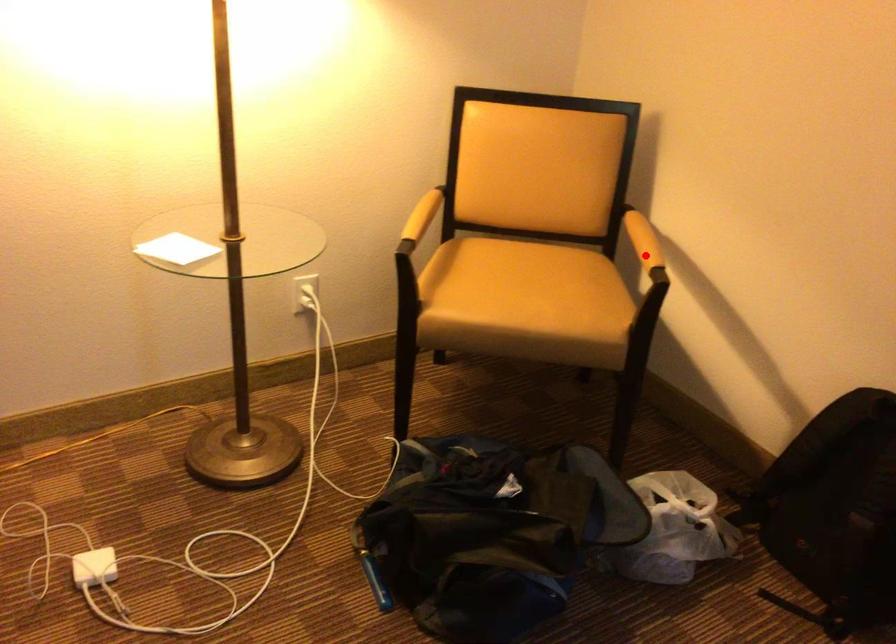
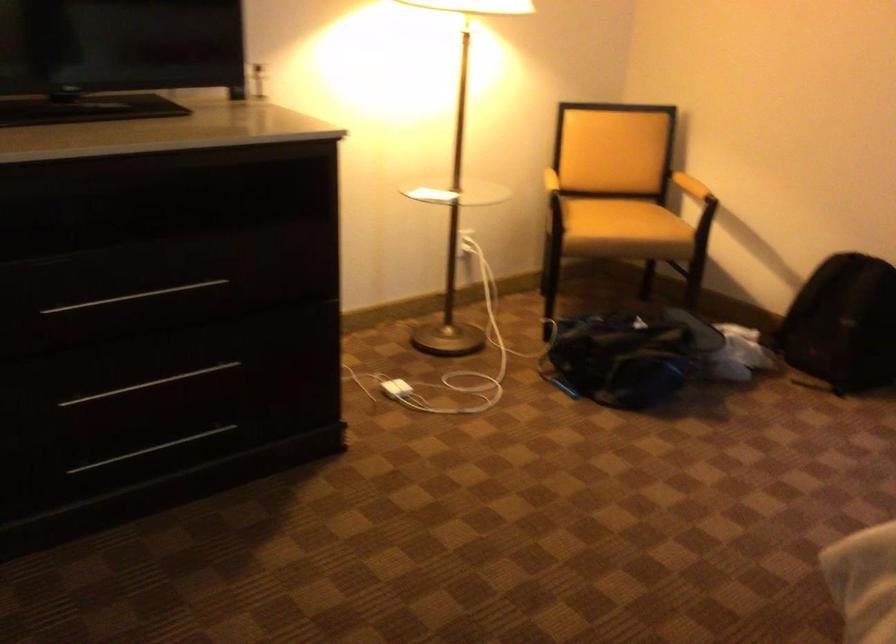
Find the pixel in the second image that matches the highlighted location in the first image.

(690, 185)